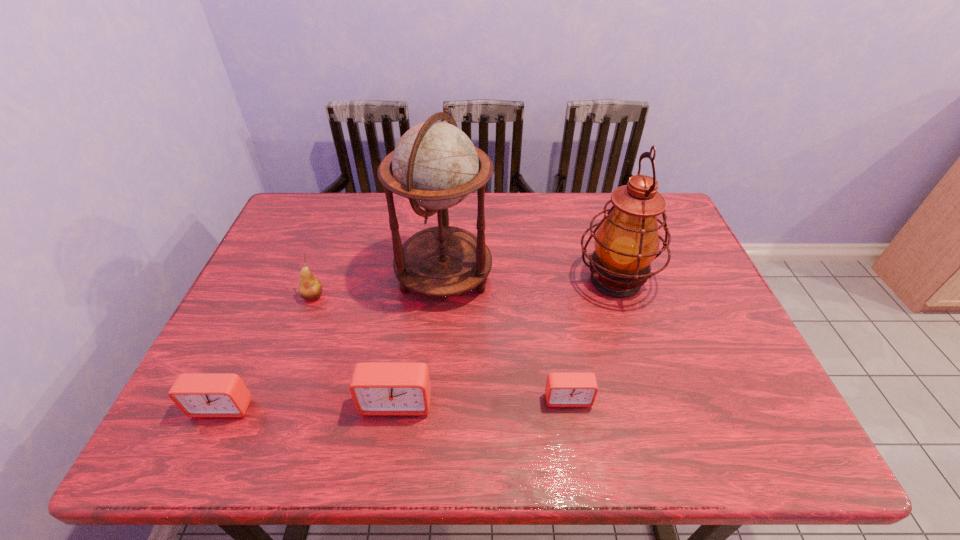
I want to click on free space that is in between the second shortest alarm clock and the tallest alarm clock, so click(309, 404).

This screenshot has height=540, width=960. I want to click on vacant space in between the second shortest object and the globe, so click(x=333, y=341).

Select which object is the fourth closest to the tallest alarm clock. Please provide its 2D coordinates. Your answer should be formatted as a tuple, i.e. [(x, y)], where the tuple contains the x and y coordinates of a point satisfying the conditions above.

[(310, 288)]

Locate which object is the fifth closest to the shortest alarm clock. Please provide its 2D coordinates. Your answer should be formatted as a tuple, i.e. [(x, y)], where the tuple contains the x and y coordinates of a point satisfying the conditions above.

[(201, 395)]

Identify which alarm clock is located as the second nearest to the rightmost alarm clock. Please provide its 2D coordinates. Your answer should be formatted as a tuple, i.e. [(x, y)], where the tuple contains the x and y coordinates of a point satisfying the conditions above.

[(201, 395)]

Where is `alarm clock that is the nearest to the shortest alarm clock`? alarm clock that is the nearest to the shortest alarm clock is located at coordinates (378, 388).

Find the location of a particular element. Image resolution: width=960 pixels, height=540 pixels. free space that satisfies the following two spatial constraints: 1. on the surface of the globe; 2. on the front-facing side of the fifth tallest object is located at coordinates (433, 407).

The height and width of the screenshot is (540, 960). I want to click on vacant space that satisfies the following two spatial constraints: 1. on the surface of the globe; 2. on the front-facing side of the tallest alarm clock, so click(x=434, y=402).

This screenshot has width=960, height=540. Identify the location of blank space that satisfies the following two spatial constraints: 1. on the surface of the oil lamp; 2. on the right side of the globe. (444, 280).